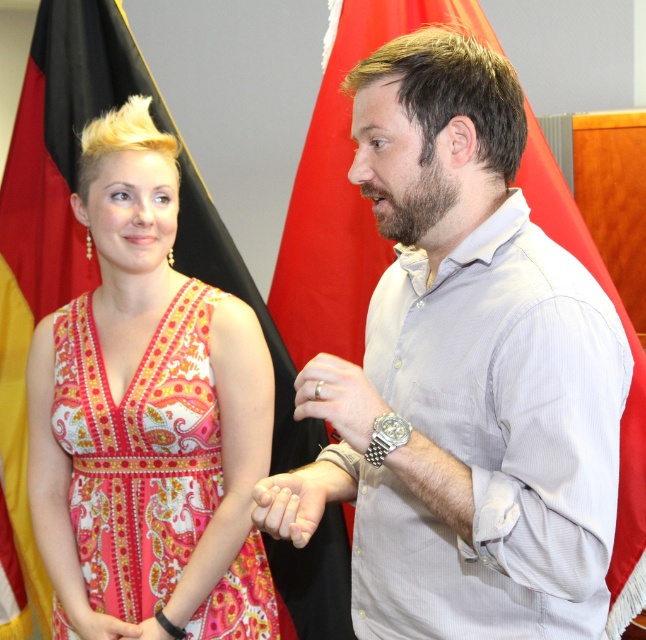
Question: Among these points, which one is farthest from the camera?

Choices:
 (A) (74, 86)
 (B) (174, 355)
 (C) (287, 532)
 (D) (339, 372)

Answer: (A)

Question: Which object is farther from the camera taking this photo?

Choices:
 (A) black fabric flag at upper left
 (B) gray fabric shirt at center
 (C) smooth skin hand at center
 (D) pink fabric dress at lower left

Answer: (A)

Question: Does printed fabric dress at center have a smaller size compared to silver metallic ring at center?

Choices:
 (A) no
 (B) yes

Answer: (A)

Question: Does black fabric flag at upper left have a larger size compared to black leather watch at center?

Choices:
 (A) no
 (B) yes

Answer: (B)

Question: Based on their relative distances, which object is nearer to the smooth skin hand at center?

Choices:
 (A) silver metallic ring at center
 (B) pink fabric dress at lower left
 (C) gray fabric shirt at center

Answer: (A)

Question: Does gray fabric shirt at center have a greater width compared to smooth skin hand at center?

Choices:
 (A) no
 (B) yes

Answer: (B)